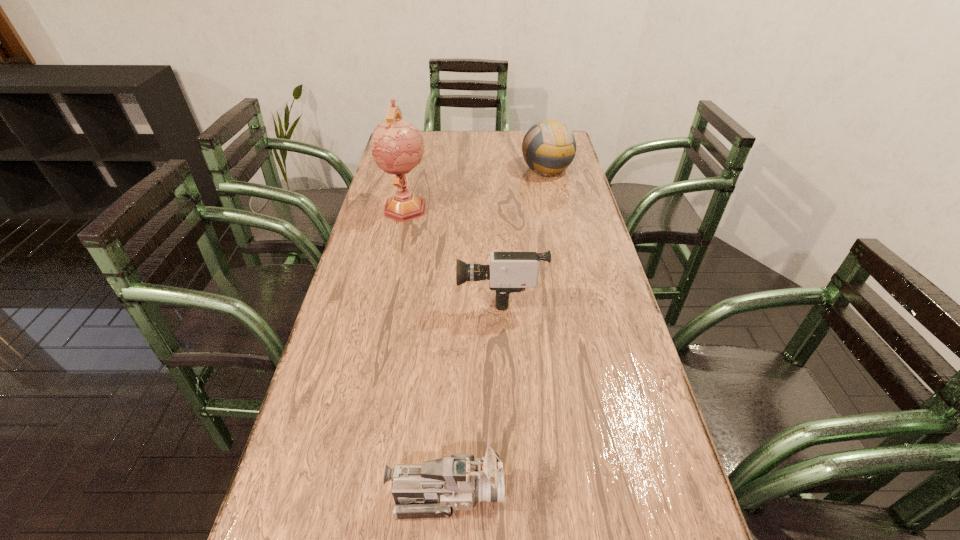
This screenshot has height=540, width=960. Find the location of `the third nearest object`. the third nearest object is located at coordinates (397, 146).

The width and height of the screenshot is (960, 540). What are the coordinates of `the leftmost object` in the screenshot? It's located at (397, 146).

At what (x,y) coordinates should I click in order to perform the action: click on the farthest object. Please return your answer as a coordinate pair (x, y). Looking at the image, I should click on (549, 146).

Where is `the second nearest object`? the second nearest object is located at coordinates (509, 271).

Locate an element on the screen. Image resolution: width=960 pixels, height=540 pixels. the taller camcorder is located at coordinates (509, 271).

Where is `the shorter camcorder`? the shorter camcorder is located at coordinates (428, 490).

Identify the location of the nearest object. The height and width of the screenshot is (540, 960). (428, 490).

The width and height of the screenshot is (960, 540). Find the location of `vacant region located 0.370m on the front-facing side of the second farthest object`. vacant region located 0.370m on the front-facing side of the second farthest object is located at coordinates (383, 310).

Image resolution: width=960 pixels, height=540 pixels. Identify the location of vacant area situated 0.300m on the left of the farthest object. click(443, 168).

What are the coordinates of `free spot located on the recording direction of the farther camcorder` in the screenshot? It's located at (441, 293).